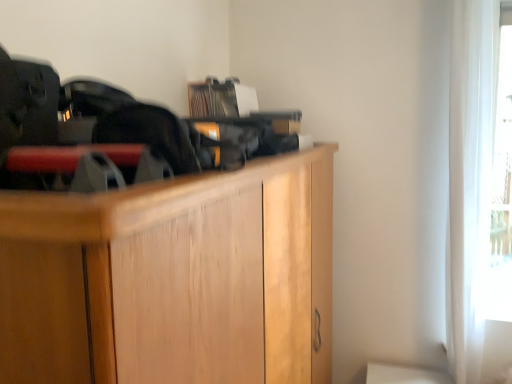
This screenshot has width=512, height=384. Find the location of `white sheer curtain at right`. white sheer curtain at right is located at coordinates (469, 182).

Image resolution: width=512 pixels, height=384 pixels. What do you see at coordinates (469, 182) in the screenshot?
I see `white sheer curtain at right` at bounding box center [469, 182].

Locate an element on the screen. This screenshot has width=512, height=384. light brown wood cabinet at center is located at coordinates (173, 279).

Image resolution: width=512 pixels, height=384 pixels. Describe the element at coordinates (173, 279) in the screenshot. I see `light brown wood cabinet at center` at that location.

What is the approximate width of light brown wood cabinet at center?

26.34 inches.

I want to click on white sheer curtain at right, so click(469, 182).

Considering the positions of objects light brown wood cabinet at center and white sheer curtain at right in the image provided, who is more to the right, light brown wood cabinet at center or white sheer curtain at right?

From the viewer's perspective, white sheer curtain at right appears more on the right side.

In the image, is light brown wood cabinet at center positioned in front of or behind white sheer curtain at right?

light brown wood cabinet at center is positioned closer to the viewer than white sheer curtain at right.

Is point (181, 281) closer or farther from the camera than point (469, 15)?

Point (181, 281) is closer to the camera than point (469, 15).

From the image's perspective, between light brown wood cabinet at center and white sheer curtain at right, which one is located above?

white sheer curtain at right appears higher in the image.

From a real-world perspective, is light brown wood cabinet at center on top of white sheer curtain at right?

Actually, light brown wood cabinet at center is physically below white sheer curtain at right in the real world.

Looking at this image, between light brown wood cabinet at center and white sheer curtain at right, which one has smaller width?

Thinner between the two is white sheer curtain at right.

Considering the sizes of objects light brown wood cabinet at center and white sheer curtain at right in the image provided, who is shorter, light brown wood cabinet at center or white sheer curtain at right?

With less height is light brown wood cabinet at center.

Who is smaller, light brown wood cabinet at center or white sheer curtain at right?

Answer: With smaller size is white sheer curtain at right.

In the scene shown: Can white sheer curtain at right be found inside light brown wood cabinet at center?

That's incorrect, white sheer curtain at right is not inside light brown wood cabinet at center.

Are light brown wood cabinet at center and white sheer curtain at right located far from each other?

Yes, light brown wood cabinet at center and white sheer curtain at right are located far from each other.

Could you tell me if light brown wood cabinet at center is turned towards white sheer curtain at right?

Yes, light brown wood cabinet at center is aimed at white sheer curtain at right.

Can you tell me how much light brown wood cabinet at center and white sheer curtain at right differ in facing direction?

There is a 90.7-degree angle between the facing directions of light brown wood cabinet at center and white sheer curtain at right.

You are a GUI agent. You are given a task and a screenshot of the screen. Output one action in this format:
    pyautogui.click(x=<x>, y=<y>)
    Task: Click on the curtain that appears behind the light brown wood cabinet at center
    
    Given the screenshot: What is the action you would take?
    pyautogui.click(x=469, y=182)

Is white sheer curtain at right to the left of light brown wood cabinet at center from the viewer's perspective?

Incorrect, white sheer curtain at right is not on the left side of light brown wood cabinet at center.

Is white sheer curtain at right further to camera compared to light brown wood cabinet at center?

Yes, it is behind light brown wood cabinet at center.

Considering the points (462, 322) and (36, 276), which point is behind, point (462, 322) or point (36, 276)?

Point (462, 322)

From the image's perspective, is white sheer curtain at right on light brown wood cabinet at center?

Yes, from the image's perspective, white sheer curtain at right is on top of light brown wood cabinet at center.

From a real-world perspective, between white sheer curtain at right and light brown wood cabinet at center, who is vertically higher?

In real-world perspective, white sheer curtain at right is above.

Between white sheer curtain at right and light brown wood cabinet at center, which one has larger width?

light brown wood cabinet at center.

Who is taller, white sheer curtain at right or light brown wood cabinet at center?

Standing taller between the two is white sheer curtain at right.

Considering the relative sizes of white sheer curtain at right and light brown wood cabinet at center in the image provided, is white sheer curtain at right bigger than light brown wood cabinet at center?

Actually, white sheer curtain at right might be smaller than light brown wood cabinet at center.

Could light brown wood cabinet at center be considered to be inside white sheer curtain at right?

No, white sheer curtain at right does not contain light brown wood cabinet at center.

Is white sheer curtain at right next to light brown wood cabinet at center and touching it?

They are not placed beside each other.

Looking at this image, is white sheer curtain at right facing towards light brown wood cabinet at center?

No, white sheer curtain at right does not turn towards light brown wood cabinet at center.

How different are the orientations of white sheer curtain at right and light brown wood cabinet at center in degrees?

90.7 degrees.

Find the location of a particular element. The image size is (512, 384). curtain located on the right of light brown wood cabinet at center is located at coordinates (469, 182).

Where is `curtain above the light brown wood cabinet at center (from the image's perspective)`? curtain above the light brown wood cabinet at center (from the image's perspective) is located at coordinates (469, 182).

I want to click on cabinetry on the left of white sheer curtain at right, so click(x=173, y=279).